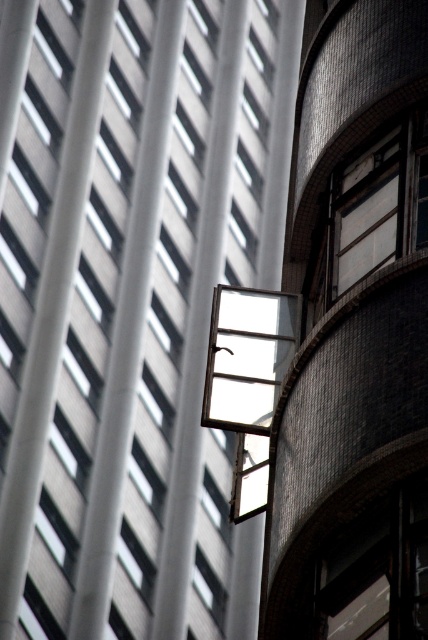
Which is more to the left, transparent glass window at center or metallic glass window at upper right?

transparent glass window at center is more to the left.

Can you confirm if transparent glass window at center is shorter than metallic glass window at upper right?

Incorrect, transparent glass window at center's height does not fall short of metallic glass window at upper right's.

Which is behind, point (11, 390) or point (231, 328)?

Positioned behind is point (11, 390).

At what (x,y) coordinates should I click in order to perform the action: click on transparent glass window at center. Please return your answer as a coordinate pair (x, y). The image size is (428, 640). Looking at the image, I should click on (128, 305).